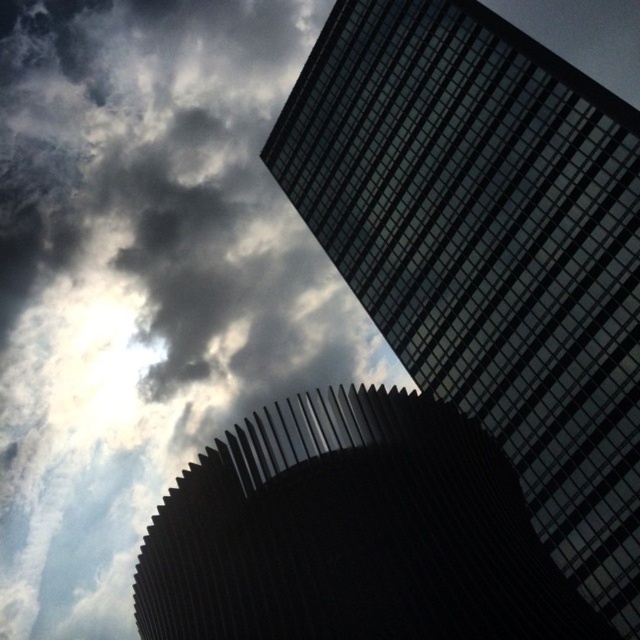
You are a drone operator who needs to fly a drone from the rough metal structure at lower center to the glassy reflective skyscraper at upper right. The drone has a maximum flight distance of 25 meters. Can the drone complete the journey without needing to recharge?

The distance between the glassy reflective skyscraper at upper right and the rough metal structure at lower center is 28.86 meters. Since the drone can only fly 25 meters before needing to recharge, it cannot complete the journey without recharging.

You are standing in the city and see the point at coordinates (141, 278). Based on the scene, what is the most likely object or feature at that location?

The cloudy sky at upper left is represented by point (141, 278).